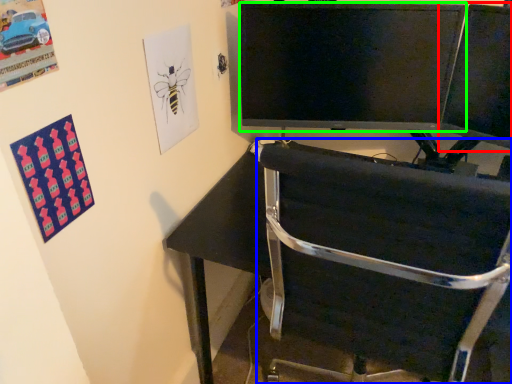
Question: Considering the real-world distances, which object is closest to computer monitor (highlighted by a red box)? chair (highlighted by a blue box) or television (highlighted by a green box).

Choices:
 (A) chair
 (B) television

Answer: (B)